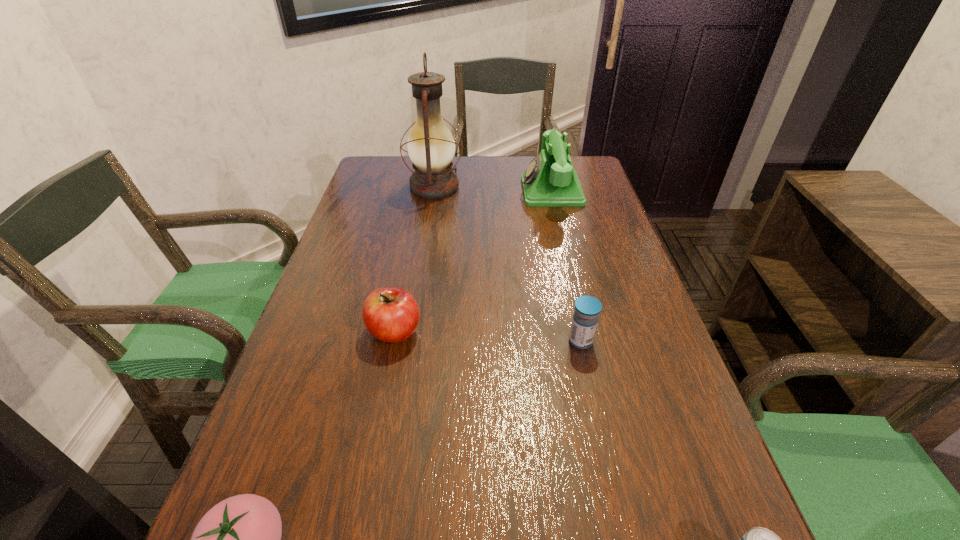
Where is `vacant area at the right edge of the desktop`? Image resolution: width=960 pixels, height=540 pixels. vacant area at the right edge of the desktop is located at coordinates (590, 250).

At what (x,y) coordinates should I click in order to perform the action: click on vacant space at the far left corner of the desktop. Please return your answer as a coordinate pair (x, y). The width and height of the screenshot is (960, 540). Looking at the image, I should click on (410, 176).

The image size is (960, 540). What are the coordinates of `free point at the far right corner` in the screenshot? It's located at (583, 181).

This screenshot has width=960, height=540. In order to click on vacant space in between the apple and the medicine in this screenshot , I will do `click(488, 336)`.

Where is `empty space that is in between the medicine and the apple`? The width and height of the screenshot is (960, 540). empty space that is in between the medicine and the apple is located at coordinates (488, 336).

Locate an element on the screen. The image size is (960, 540). vacant space that's between the medicine and the oil lamp is located at coordinates (508, 264).

At what (x,y) coordinates should I click in order to perform the action: click on vacant point located between the apple and the tallest object. Please return your answer as a coordinate pair (x, y). The image size is (960, 540). Looking at the image, I should click on (415, 259).

Point out which object is positioned as the second nearest to the oil lamp. Please provide its 2D coordinates. Your answer should be formatted as a tuple, i.e. [(x, y)], where the tuple contains the x and y coordinates of a point satisfying the conditions above.

[(391, 314)]

Locate an element on the screen. object that is the second closest to the telephone is located at coordinates (587, 308).